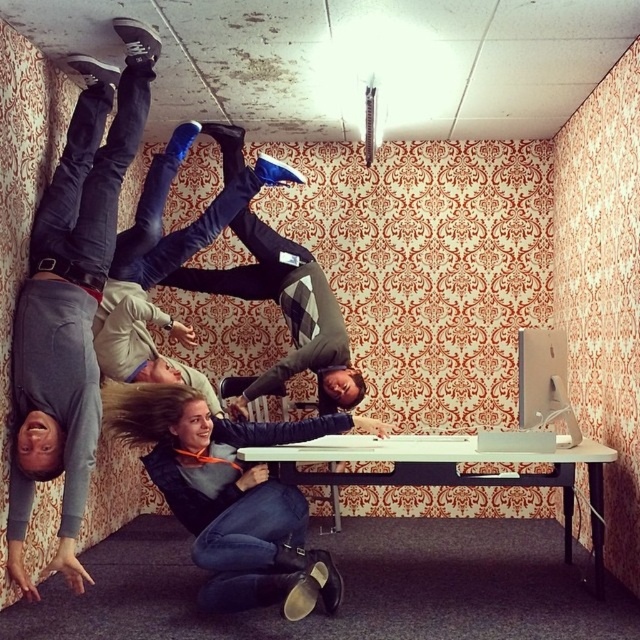
Question: Among these objects, which one is farthest from the camera?

Choices:
 (A) gray matte pants at lower left
 (B) white glossy table at center

Answer: (B)

Question: Which of the following is the closest to the observer?

Choices:
 (A) white glossy table at center
 (B) gray matte pants at lower left

Answer: (B)

Question: Is gray matte pants at lower left positioned at the back of white glossy table at center?

Choices:
 (A) yes
 (B) no

Answer: (B)

Question: Is gray matte pants at lower left bigger than white glossy table at center?

Choices:
 (A) no
 (B) yes

Answer: (A)

Question: Is gray matte pants at lower left in front of white glossy table at center?

Choices:
 (A) no
 (B) yes

Answer: (B)

Question: Which point appears farthest from the camera in this image?

Choices:
 (A) (568, 481)
 (B) (76, 468)

Answer: (A)